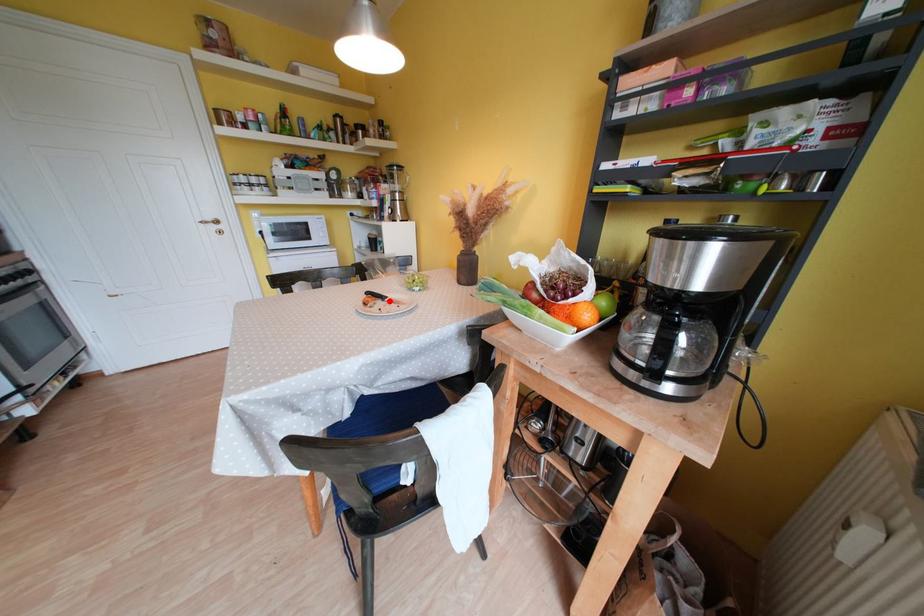
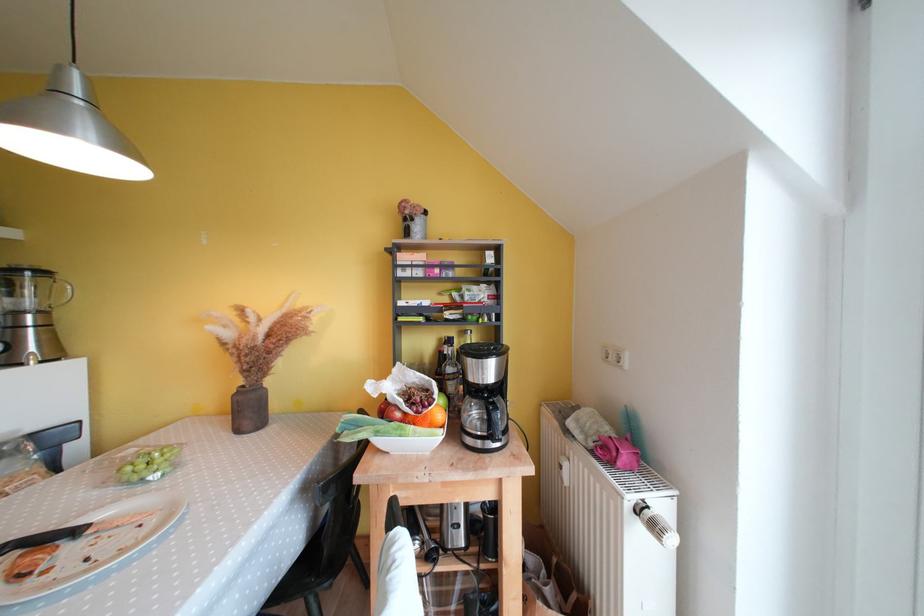
Find the pixel in the second image that matches the highlighted location in the first image.

(83, 535)